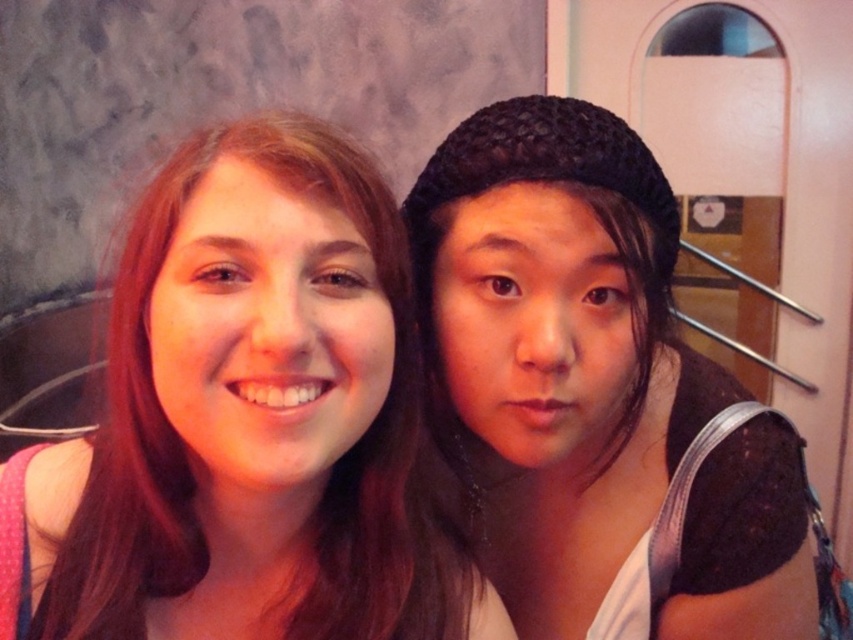
You are taking a photo of two people standing side by side. The person on the left is wearing a matte pink shirt at left, and the person on the right is wearing a black knitted hat at right. Based on the scene, which clothing item is positioned higher in the image?

The matte pink shirt at left is positioned higher in the image because it is above the black knitted hat at right.

You are a photographer setting up for a group photo. You need to ensure that all subjects are visible in the frame. Given the current positions of the matte pink shirt at left and the black knitted hat at right, which object should you adjust to make sure both are fully visible?

The matte pink shirt at left occupies less space than the black knitted hat at right. To ensure both are fully visible, adjust the position of the matte pink shirt at left so it takes up more space in the frame.

You are standing in a cafe and want to take a photo of the two people at point [172,273]. If you are 17.50 inches away from the point, will you be able to capture both individuals in the frame?

Yes, since the distance between you and the point [172,273] is 17.50 inches, which is the exact distance provided, so both individuals at that point can be captured in the frame.